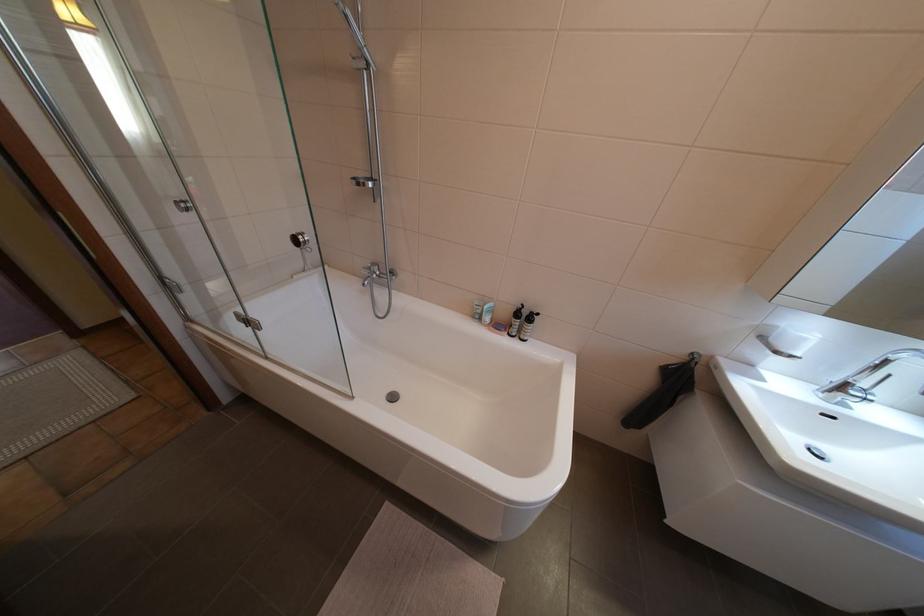
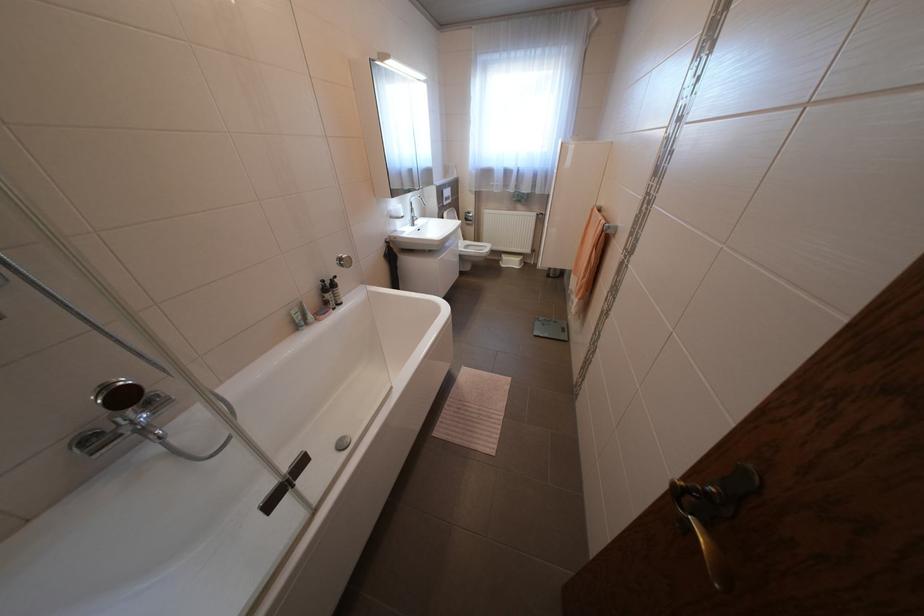
In the second image, find the point that corresponds to [773,338] in the first image.

(402, 216)